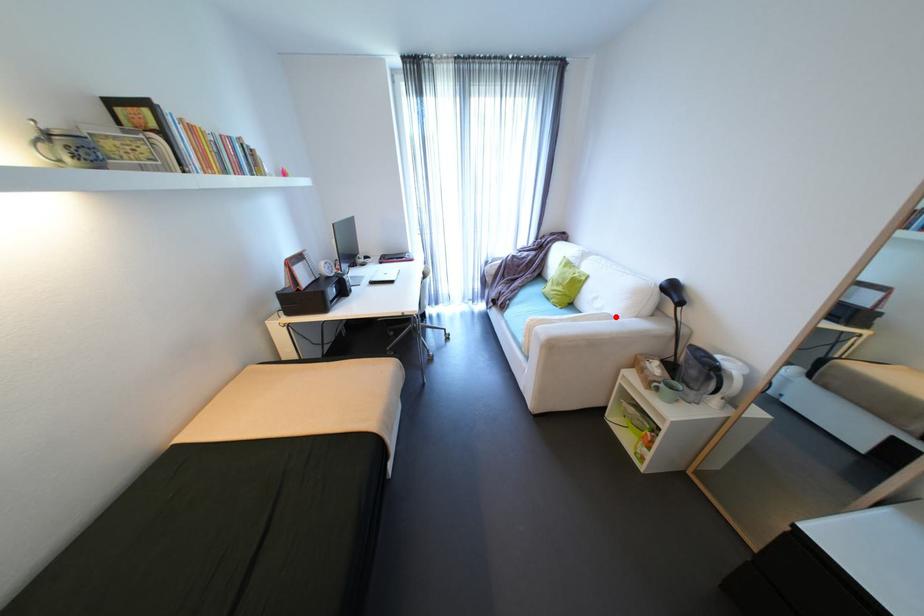
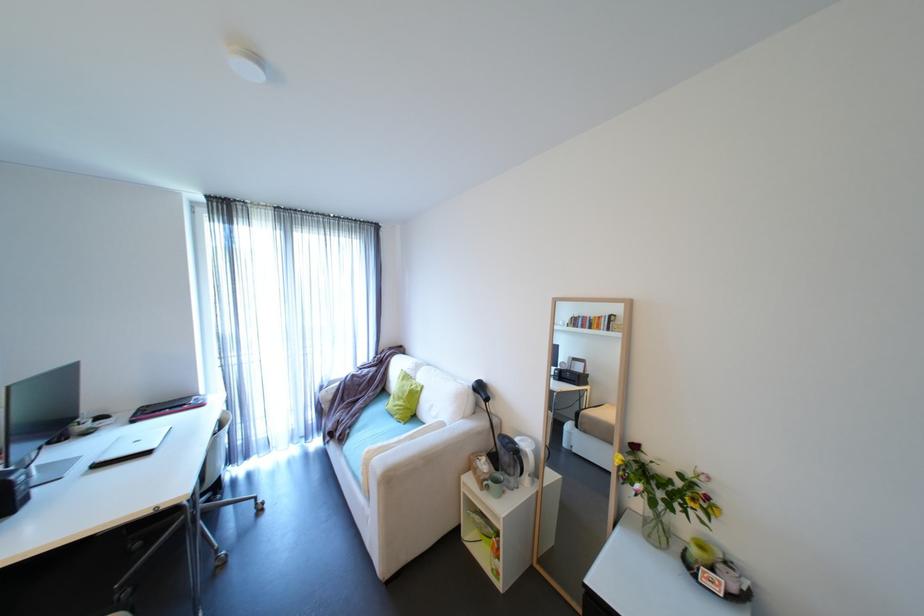
Question: I am providing you with two images of the same scene from different viewpoints. Given a red point in image1, look at the same physical point in image2. Is it:

Choices:
 (A) Closer to the viewpoint
 (B) Farther from the viewpoint

Answer: (B)